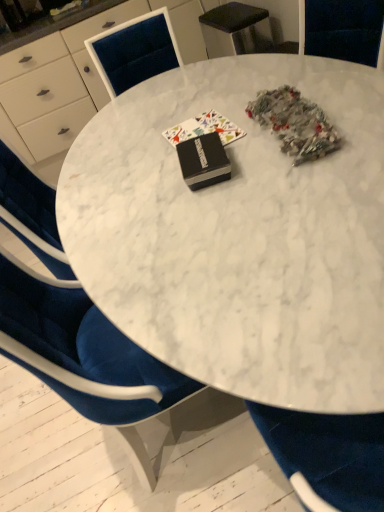
The height and width of the screenshot is (512, 384). What are the coordinates of `empty space that is to the right of black matte book at center, which is counted as the 2th book, starting from the front` in the screenshot? It's located at (237, 108).